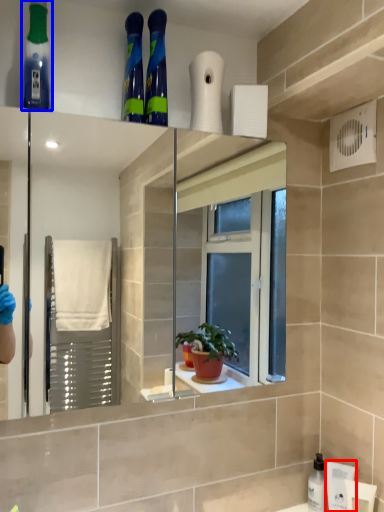
Question: Which object appears closest to the camera in this image, toiletry (highlighted by a red box) or mouthwash (highlighted by a blue box)?

Choices:
 (A) toiletry
 (B) mouthwash

Answer: (B)